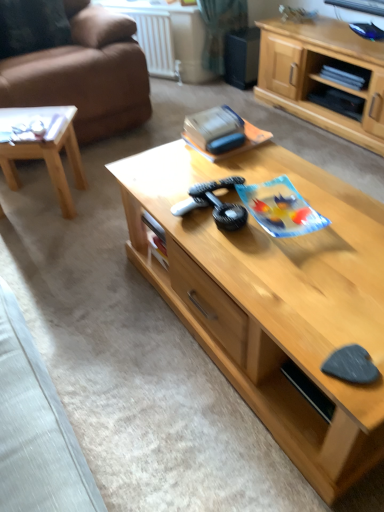
You are a GUI agent. You are given a task and a screenshot of the screen. Output one action in this format:
    pyautogui.click(x=<x>, y=<y>)
    Task: Click on the vacant region to the left of light wood coffee table at center, which is counted as the second coffee table, starting from the left
    The height and width of the screenshot is (512, 384).
    Given the screenshot: What is the action you would take?
    pyautogui.click(x=106, y=318)